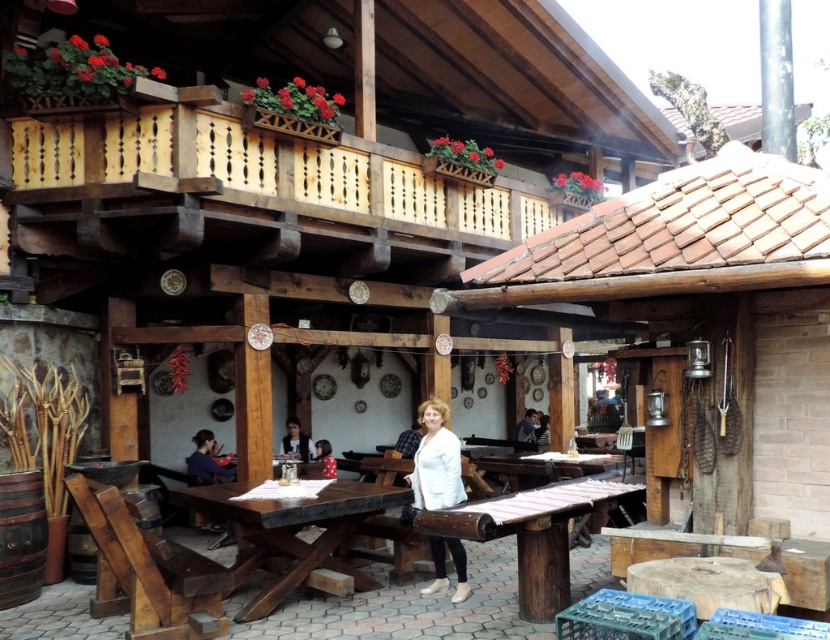
You are a painter standing at the entrance of the rustic restaurant. You want to paint the largest object in the scene. Which object should you choose between the light brown wooden balcony at upper left and the white fabric at center?

The light brown wooden balcony at upper left has a larger size compared to white fabric at center, so you should choose the light brown wooden balcony at upper left to paint as it is the larger object between the two.

You are a customer sitting at the light brown wooden balcony at upper left and want to place your drink on the white fabric at center. Can you directly place it there without moving from your seat?

The light brown wooden balcony at upper left is positioned over white fabric at center, so you can directly place your drink on the white fabric at center from your current seat.